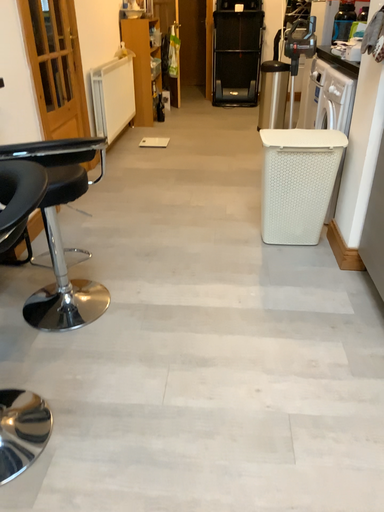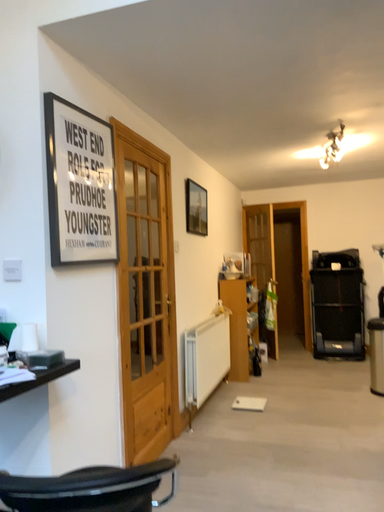
Question: Which way did the camera rotate in the video?

Choices:
 (A) rotated left
 (B) rotated right

Answer: (A)